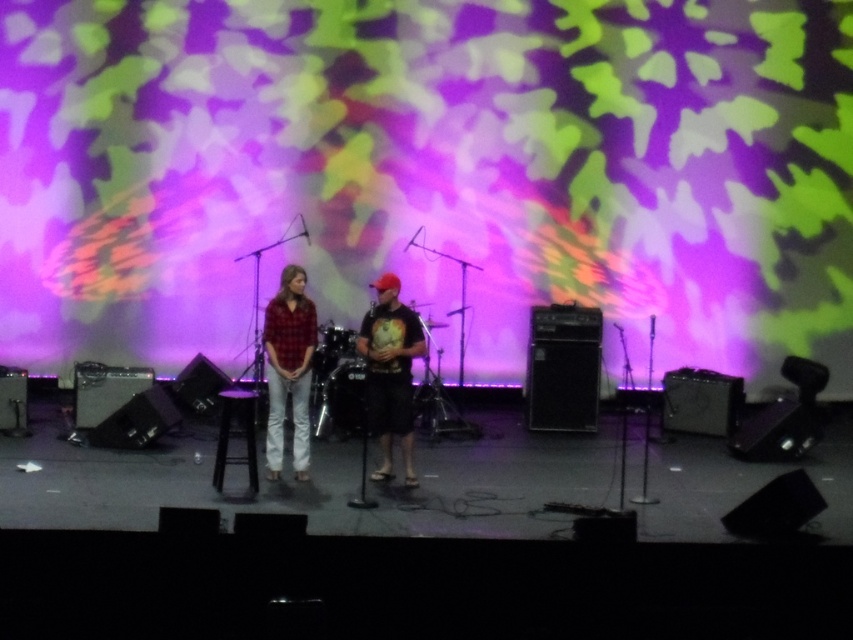
Does matte black t-shirt at center appear under plaid shirt at center?

Indeed, matte black t-shirt at center is positioned under plaid shirt at center.

Looking at this image, how far apart are matte black t-shirt at center and plaid shirt at center?

matte black t-shirt at center and plaid shirt at center are 28.49 inches apart.

The image size is (853, 640). Find the location of `matte black t-shirt at center`. matte black t-shirt at center is located at coordinates (390, 372).

What are the coordinates of `matte black t-shirt at center` in the screenshot? It's located at (390, 372).